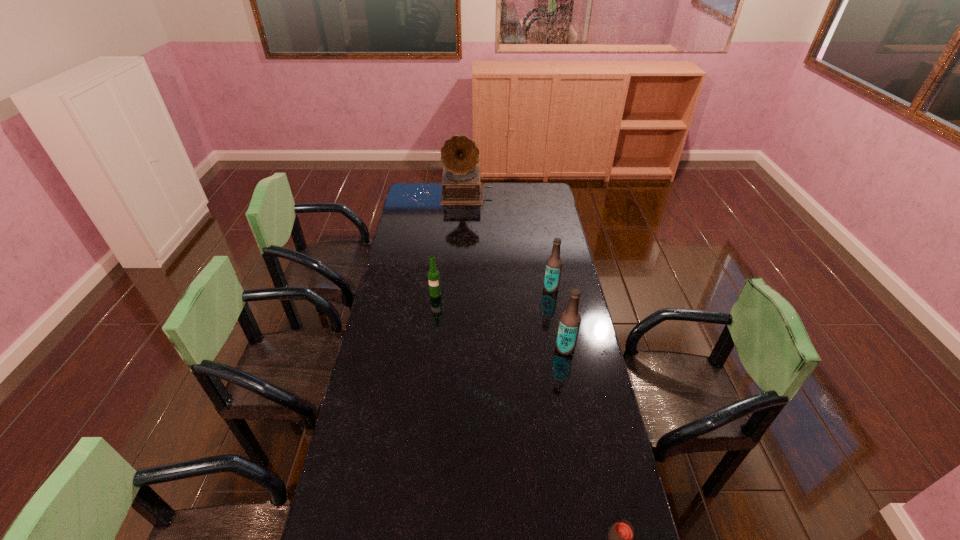
I want to click on record player, so click(461, 185).

Locate an element on the screen. This screenshot has height=540, width=960. the tallest object is located at coordinates (x=461, y=185).

Find the location of a particular element. The width and height of the screenshot is (960, 540). the fourth farthest object is located at coordinates (570, 320).

In order to click on the leftmost beer bottle in this screenshot , I will do point(433,274).

You are a GUI agent. You are given a task and a screenshot of the screen. Output one action in this format:
    pyautogui.click(x=<x>, y=<y>)
    Task: Click on the shortest beer bottle
    The width and height of the screenshot is (960, 540).
    Given the screenshot: What is the action you would take?
    pyautogui.click(x=433, y=274)

I want to click on vacant space located from the horn of the record player, so click(465, 242).

In order to click on vacant space located on the side of the nearest beer bottle with the label in this screenshot , I will do `click(514, 348)`.

Where is `vacant space situated on the side of the nearest beer bottle with the label`? vacant space situated on the side of the nearest beer bottle with the label is located at coordinates 488,348.

Find the location of a particular element. The height and width of the screenshot is (540, 960). vacant space located 0.090m on the side of the nearest beer bottle with the label is located at coordinates (532, 348).

You are a GUI agent. You are given a task and a screenshot of the screen. Output one action in this format:
    pyautogui.click(x=<x>, y=<y>)
    Task: Click on the free location located on the label of the shortest beer bottle
    
    Given the screenshot: What is the action you would take?
    pyautogui.click(x=431, y=334)